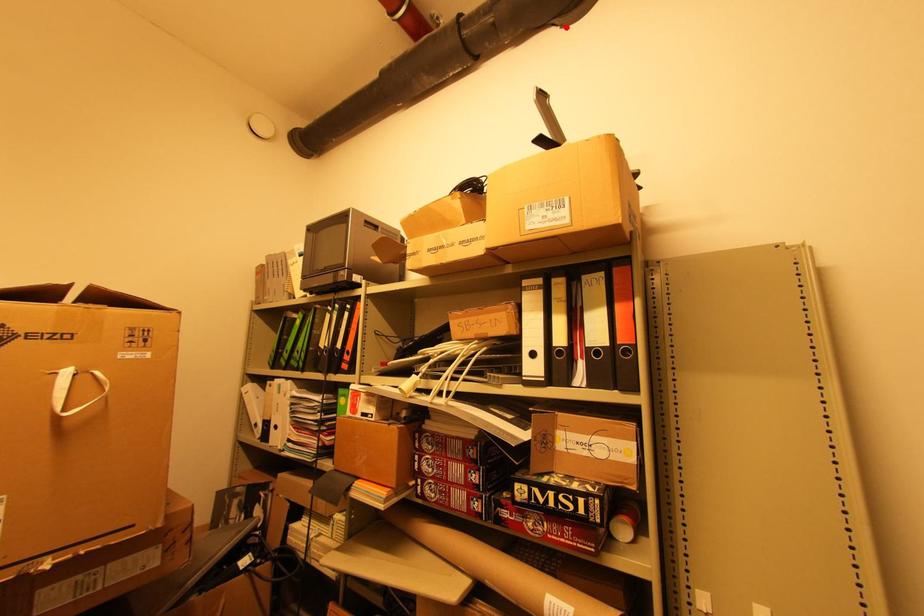
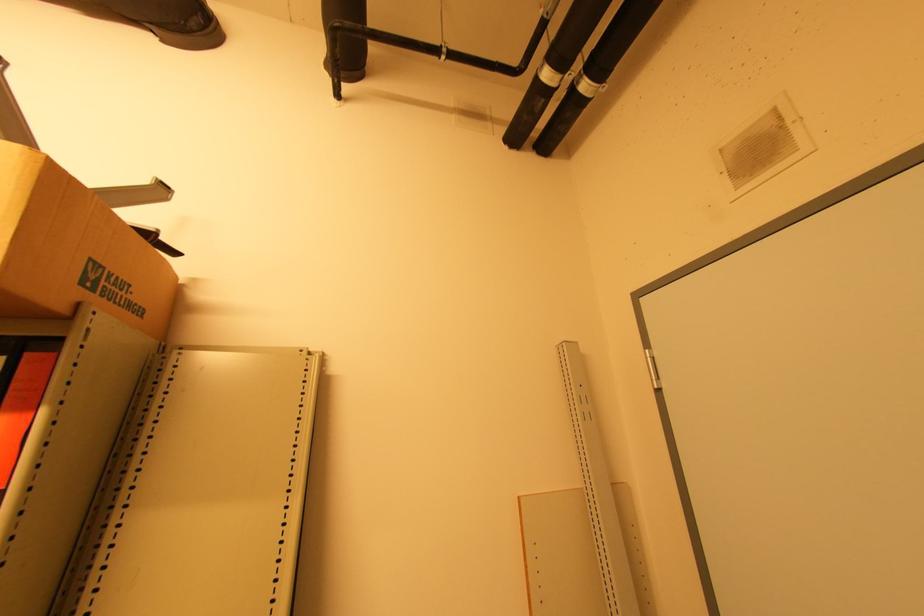
In the second image, find the point that corresponds to the highlighted location in the first image.

(165, 42)